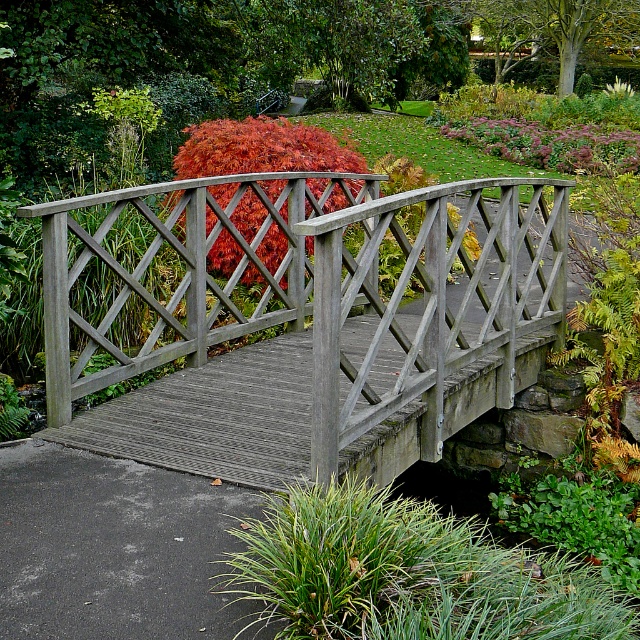
Does wooden bridge at center have a larger size compared to vivid red foliage at center?

Actually, wooden bridge at center might be smaller than vivid red foliage at center.

Does wooden bridge at center have a lesser height compared to vivid red foliage at center?

Yes.

Where is `wooden bridge at center`? This screenshot has width=640, height=640. wooden bridge at center is located at coordinates (317, 330).

Where is `wooden bridge at center`? This screenshot has height=640, width=640. wooden bridge at center is located at coordinates (317, 330).

Looking at this image, does black asphalt path at lower left have a greater height compared to vivid red foliage at center?

In fact, black asphalt path at lower left may be shorter than vivid red foliage at center.

Who is shorter, black asphalt path at lower left or vivid red foliage at center?

With less height is black asphalt path at lower left.

At what (x,y) coordinates should I click in order to perform the action: click on black asphalt path at lower left. Please return your answer as a coordinate pair (x, y). This screenshot has height=640, width=640. Looking at the image, I should click on (112, 547).

This screenshot has width=640, height=640. Find the location of `black asphalt path at lower left`. black asphalt path at lower left is located at coordinates (112, 547).

Can you confirm if wooden bridge at center is positioned to the left of black asphalt path at lower left?

No, wooden bridge at center is not to the left of black asphalt path at lower left.

Can you confirm if wooden bridge at center is bigger than black asphalt path at lower left?

Yes.

Is point (243, 470) farther from camera compared to point (10, 566)?

Yes, it is behind point (10, 566).

Locate an element on the screen. Image resolution: width=640 pixels, height=640 pixels. wooden bridge at center is located at coordinates (317, 330).